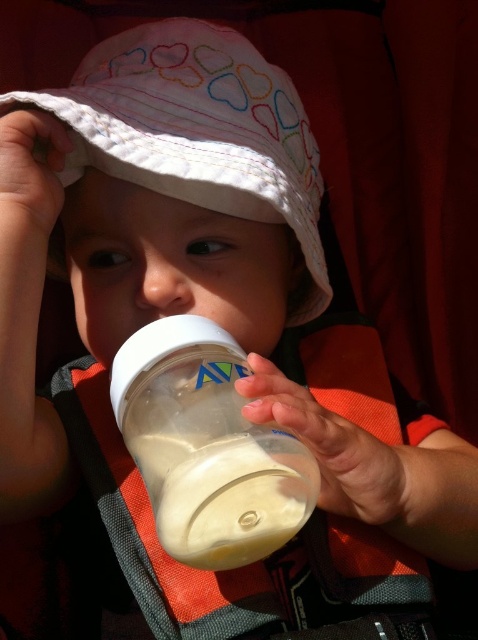
Based on the photo, you are a parent holding a baby in a stroller. The baby is wearing a hat with hearts and holding a bottle. You want to hand the baby a toy that is 12 inches long. Can the toy fit between the baby and your hand if your hand is at point (304, 145)?

The distance between the point (304, 145) and the viewer is 25.19 inches. Since the toy is only 12 inches long, it can easily fit in that space.

The child is holding a transparent plastic bottle at center. There is also a white cotton hat at upper center. How far apart are these two items?

The white cotton hat at upper center is 9.39 inches from the transparent plastic bottle at center.